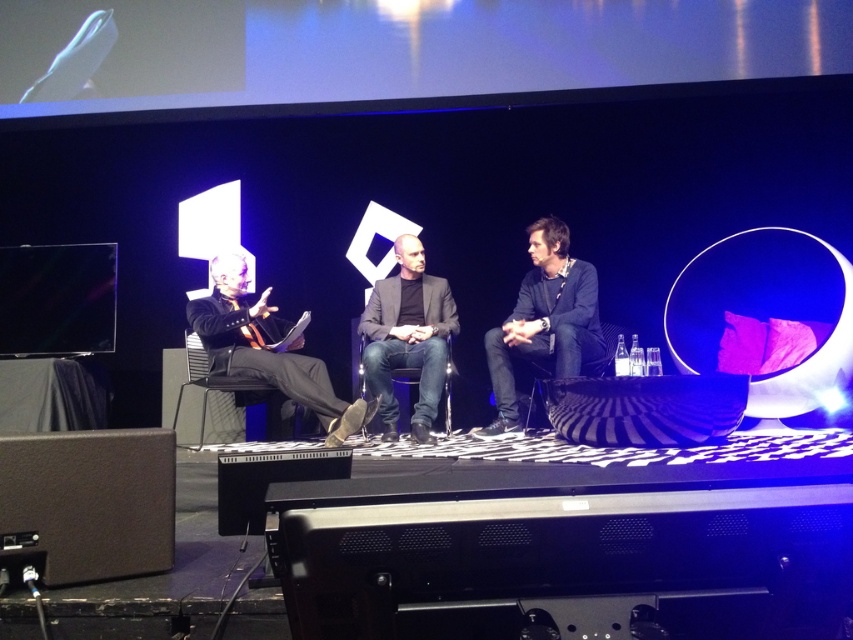
Looking at this image, you are an event organizer and need to adjust the seating arrangement. If you want to move the black leather chair at left closer to the black matte jacket at center, which direction should you move the chair?

You should move the black leather chair at left to the right to bring it closer to the black matte jacket at center, as the black matte jacket at center is currently positioned to the right of the black leather chair at left.

You are a stagehand who needs to move a 50 cm wide equipment cart from the left side of the stage to the right. Can you safely pass between the black leather jacket at left and the black leather chair at center without hitting the cart into either?

The distance between the black leather jacket at left and the black leather chair at center is 53.81 centimeters. Since the equipment cart is 50 cm wide, there is enough space to pass safely between them as the distance is slightly larger than the cart.